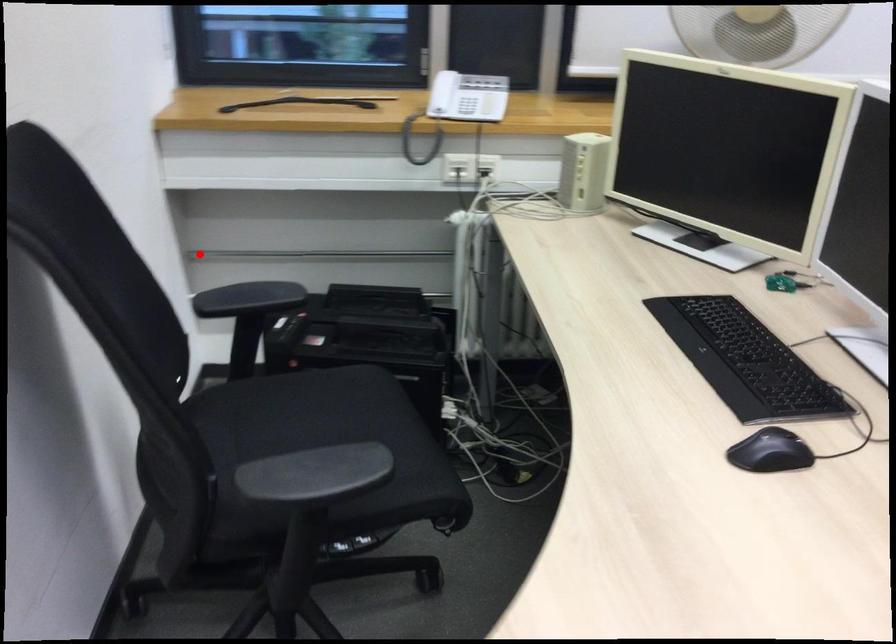
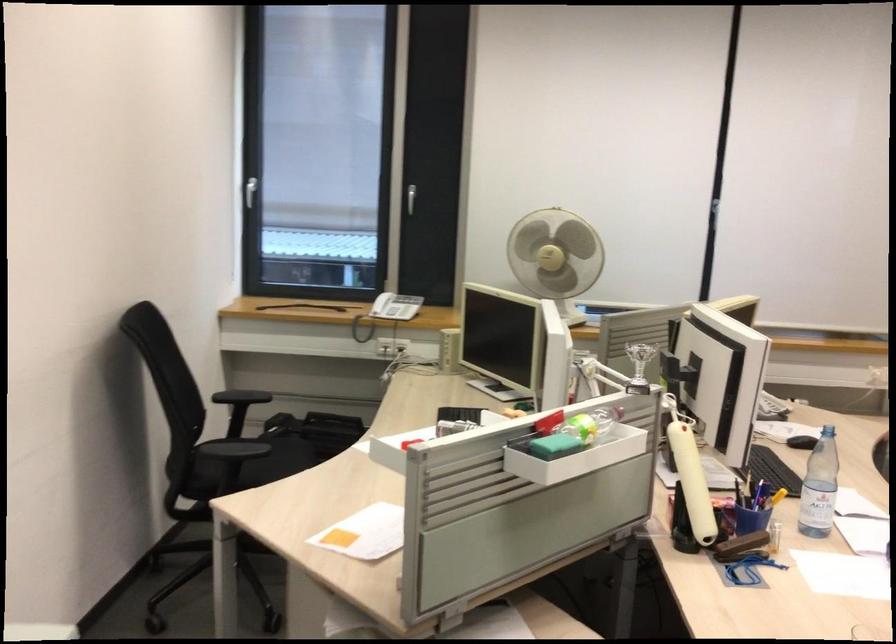
Find the pixel in the second image that matches the highlighted location in the first image.

(240, 395)